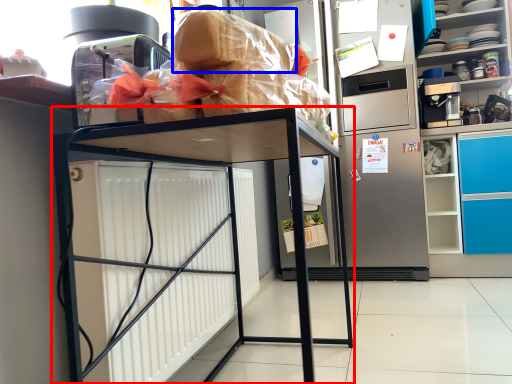
Question: Which point is closer to the camera, furniture (highlighted by a red box) or bread (highlighted by a blue box)?

Choices:
 (A) furniture
 (B) bread

Answer: (A)